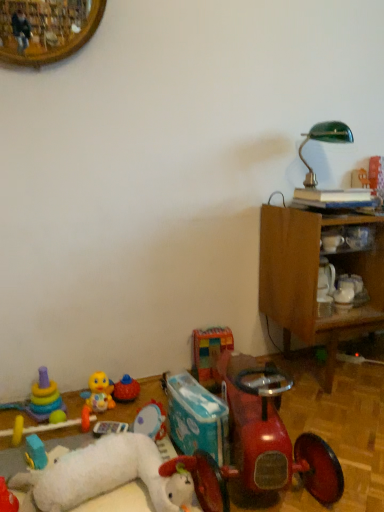
Locate an element on the screen. The width and height of the screenshot is (384, 512). free point to the left of teal rubber toy at lower left, placed as the eighth toy when sorted from right to left is located at coordinates (12, 459).